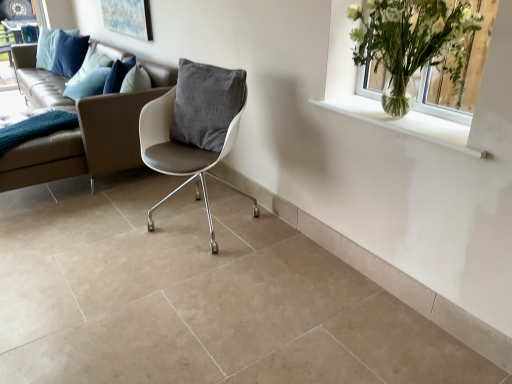
Question: Is leather couch at center to the left or to the right of clear glass vase at upper right in the image?

Choices:
 (A) right
 (B) left

Answer: (B)

Question: Is leather couch at center in front of or behind clear glass vase at upper right in the image?

Choices:
 (A) front
 (B) behind

Answer: (B)

Question: Considering the real-world distances, which object is closest to the leather couch at center?

Choices:
 (A) matte glass window frame at upper left
 (B) matte blue painting at upper left
 (C) clear glass vase at upper right
 (D) white leather chair at center
 (E) clear glass vase at upper right

Answer: (D)

Question: Estimate the real-world distances between objects in this image. Which object is farther from the matte glass window frame at upper left?

Choices:
 (A) leather couch at center
 (B) white leather chair at center
 (C) clear glass vase at upper right
 (D) clear glass vase at upper right
 (E) matte blue painting at upper left

Answer: (C)